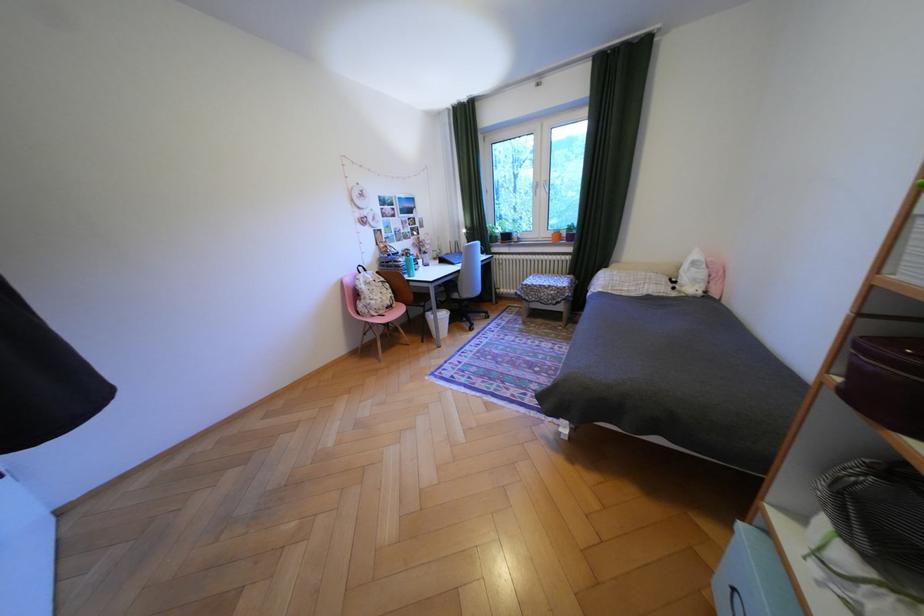
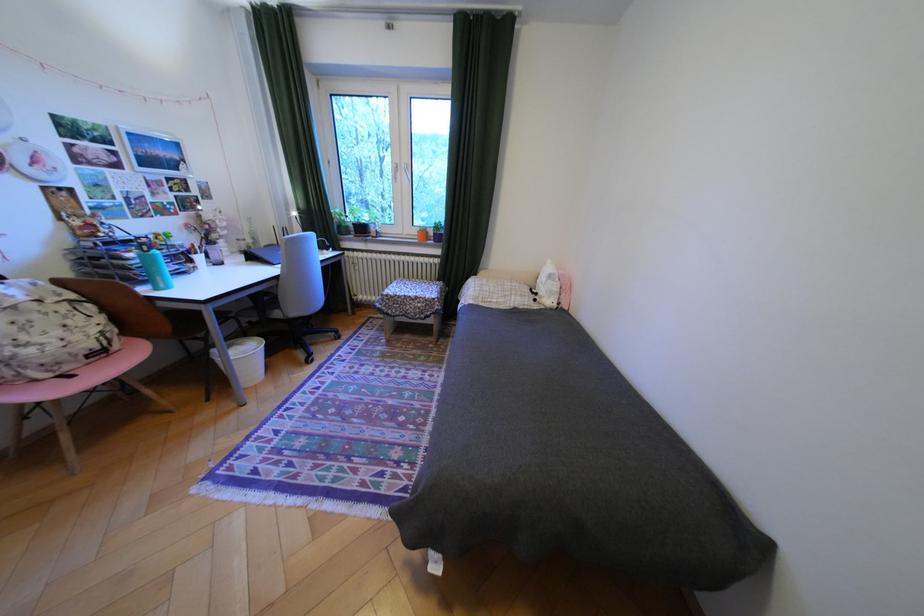
Find the pixel in the second image that matches the point at 507,237 in the first image.

(359, 227)